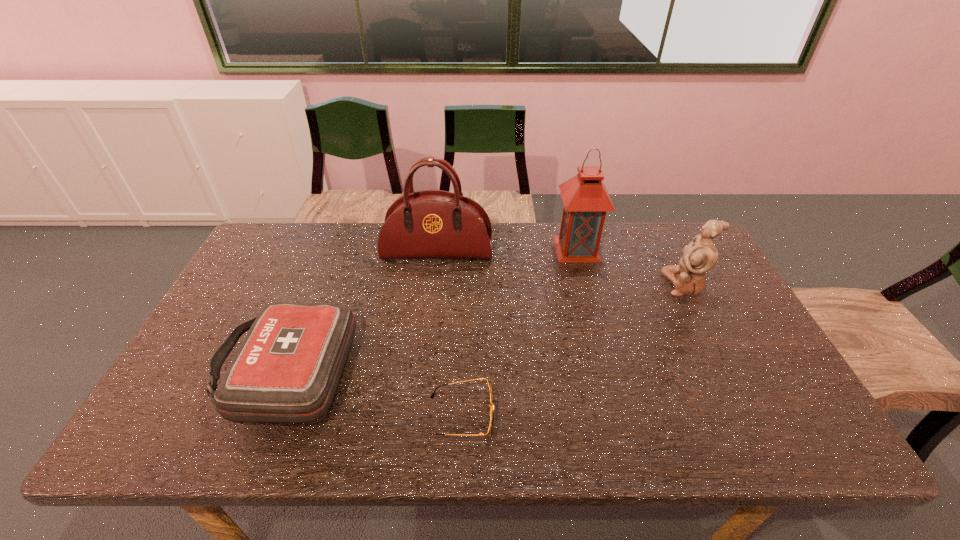
Identify the location of vacant area between the shortest object and the handbag. (449, 334).

You are a GUI agent. You are given a task and a screenshot of the screen. Output one action in this format:
    pyautogui.click(x=<x>, y=<y>)
    Task: Click on the empty space between the sunglasses and the handbag
    
    Given the screenshot: What is the action you would take?
    pyautogui.click(x=449, y=334)

You are a GUI agent. You are given a task and a screenshot of the screen. Output one action in this format:
    pyautogui.click(x=<x>, y=<y>)
    Task: Click on the empty location between the third tallest object and the handbag
    The height and width of the screenshot is (540, 960).
    Given the screenshot: What is the action you would take?
    pyautogui.click(x=561, y=268)

This screenshot has height=540, width=960. I want to click on free space that is in between the rightmost object and the leftmost object, so click(x=485, y=327).

The width and height of the screenshot is (960, 540). I want to click on vacant point located between the sunglasses and the second shortest object, so click(x=373, y=393).

Identify the location of empty space that is in between the second shortest object and the lantern. (431, 309).

Locate an element on the screen. Image resolution: width=960 pixels, height=540 pixels. object that is the closest to the sunglasses is located at coordinates (287, 370).

Choose which object is the fourth nearest neighbor to the lantern. Please provide its 2D coordinates. Your answer should be formatted as a tuple, i.e. [(x, y)], where the tuple contains the x and y coordinates of a point satisfying the conditions above.

[(287, 370)]

The image size is (960, 540). Identify the location of vacant space that satisfies the following two spatial constraints: 1. on the back side of the leftmost object; 2. on the left side of the fourth object from left to right. (334, 248).

Identify the location of free spot that satisfies the following two spatial constraints: 1. on the front side of the lantern; 2. on the lenses of the sunglasses. click(621, 416).